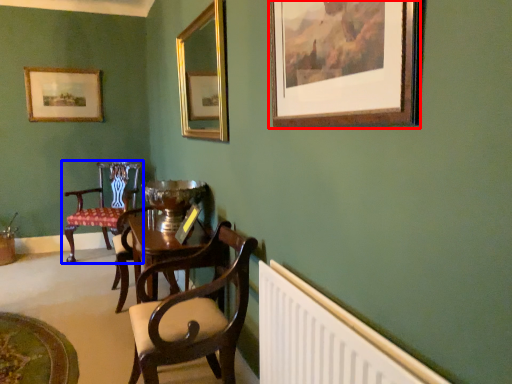
Question: Which of the following is the farthest to the observer, picture frame (highlighted by a red box) or chair (highlighted by a blue box)?

Choices:
 (A) picture frame
 (B) chair

Answer: (B)